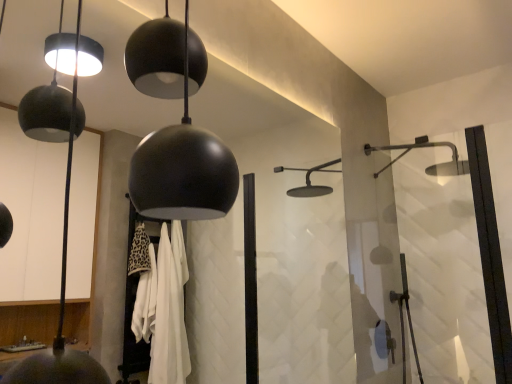
Question: Should I look upward or downward to see transparent glass shower door at right?

Choices:
 (A) up
 (B) down

Answer: (B)